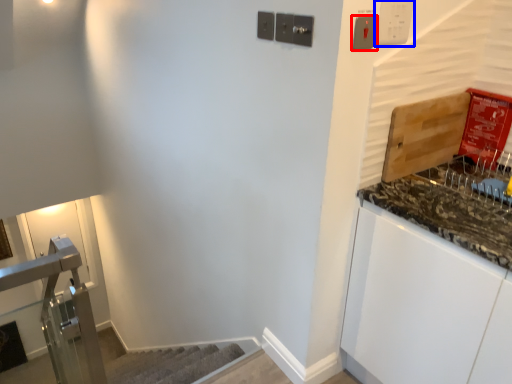
Question: Among these objects, which one is nearest to the camera, light switch (highlighted by a red box) or light switch (highlighted by a blue box)?

Choices:
 (A) light switch
 (B) light switch

Answer: (A)